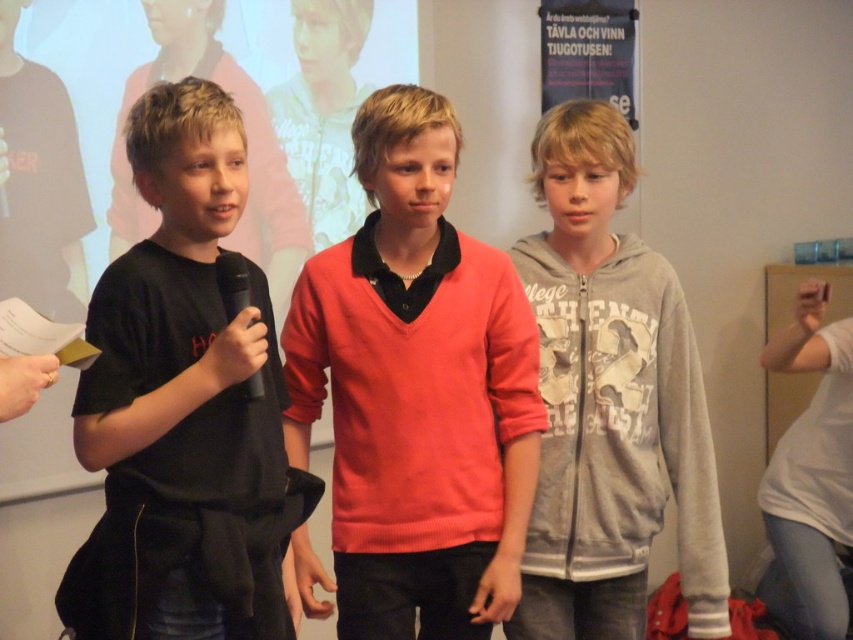
Can you confirm if matte coral sweater at center is positioned to the left of black matte shirt at left?

In fact, matte coral sweater at center is to the right of black matte shirt at left.

Who is more forward, (405,499) or (106,321)?

Positioned in front is point (106,321).

The image size is (853, 640). In order to click on matte coral sweater at center in this screenshot , I will do `click(416, 390)`.

How much distance is there between matte coral sweater at center and black matte microphone at left?

The distance of matte coral sweater at center from black matte microphone at left is 35.40 centimeters.

Does point (477, 508) come closer to viewer compared to point (236, 284)?

No, it is behind (236, 284).

Locate an element on the screen. This screenshot has height=640, width=853. matte coral sweater at center is located at coordinates (416, 390).

Is point (166, 401) positioned behind point (236, 256)?

No, it is in front of (236, 256).

Can you confirm if black matte shirt at left is positioned below black matte microphone at left?

Correct, black matte shirt at left is located below black matte microphone at left.

Who is more forward, (x=225, y=627) or (x=259, y=397)?

Point (x=259, y=397) is in front.

Find the location of `black matte shirt at left`. black matte shirt at left is located at coordinates (184, 378).